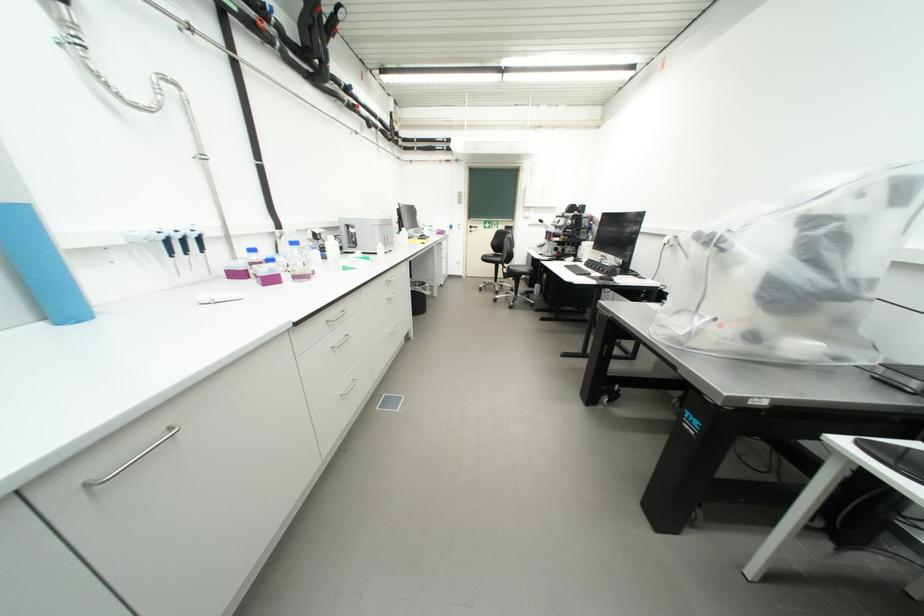
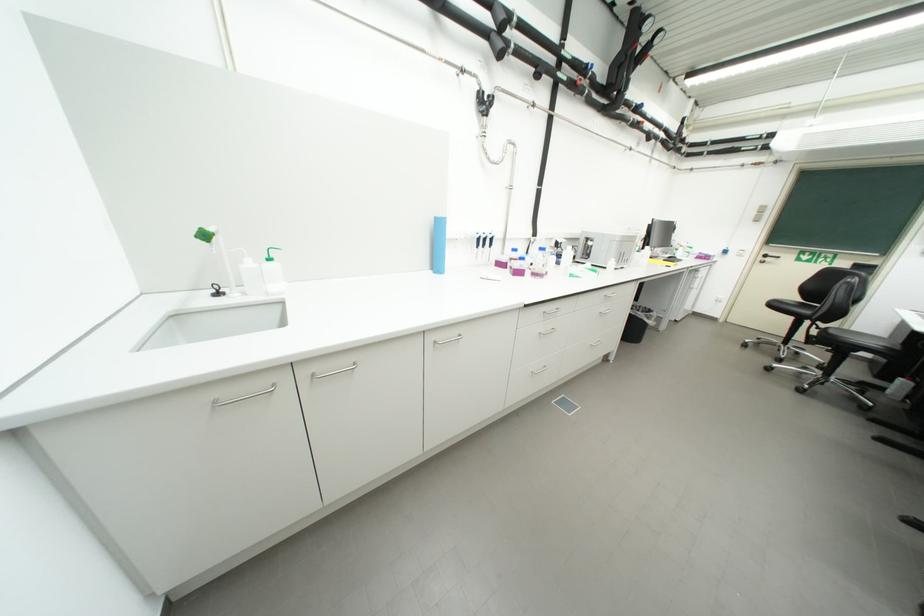
In the second image, find the point that corresponds to (x=304, y=278) in the first image.

(541, 276)